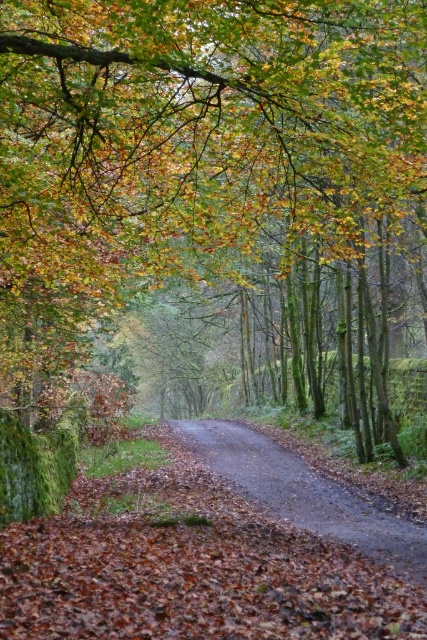
Does green leafy tree at center appear on the left side of damp asphalt road at center?

Incorrect, green leafy tree at center is not on the left side of damp asphalt road at center.

Between green leafy tree at center and damp asphalt road at center, which one is positioned lower?

damp asphalt road at center is lower down.

Identify the location of green leafy tree at center. (201, 131).